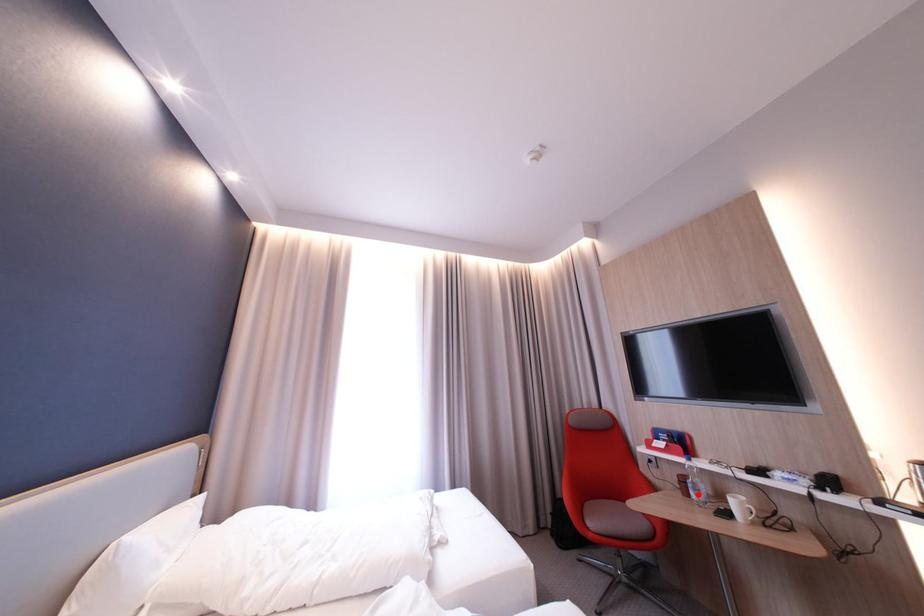
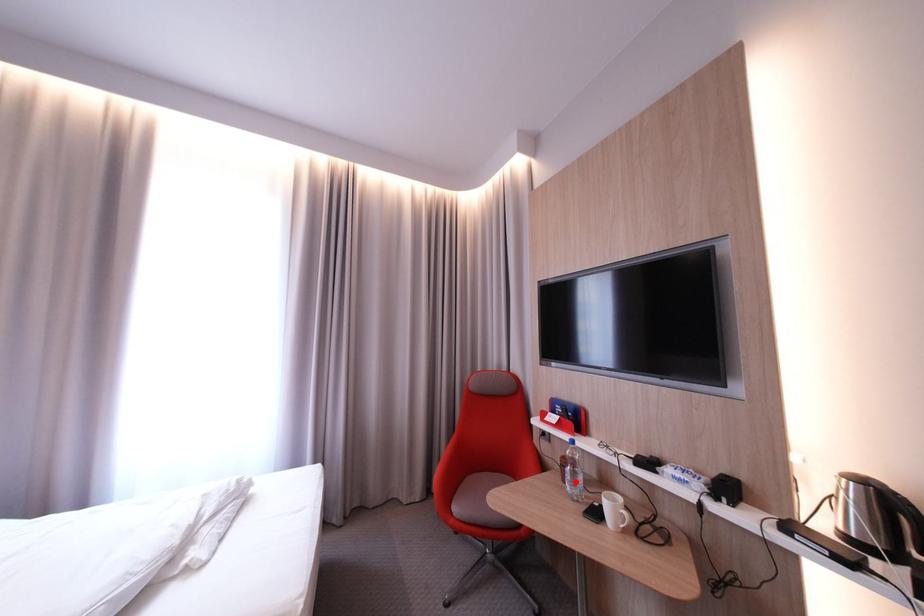
I am providing you with two images of the same scene from different viewpoints. A red point is marked on the first image and another point is marked on the second image. Are the points marked in image1 and image2 representing the same 3D position?

Result: Yes